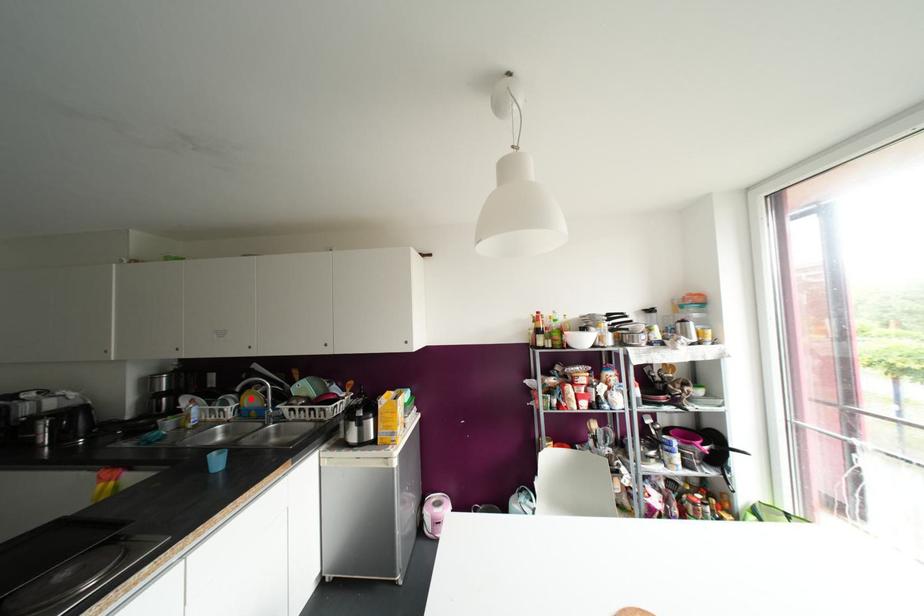
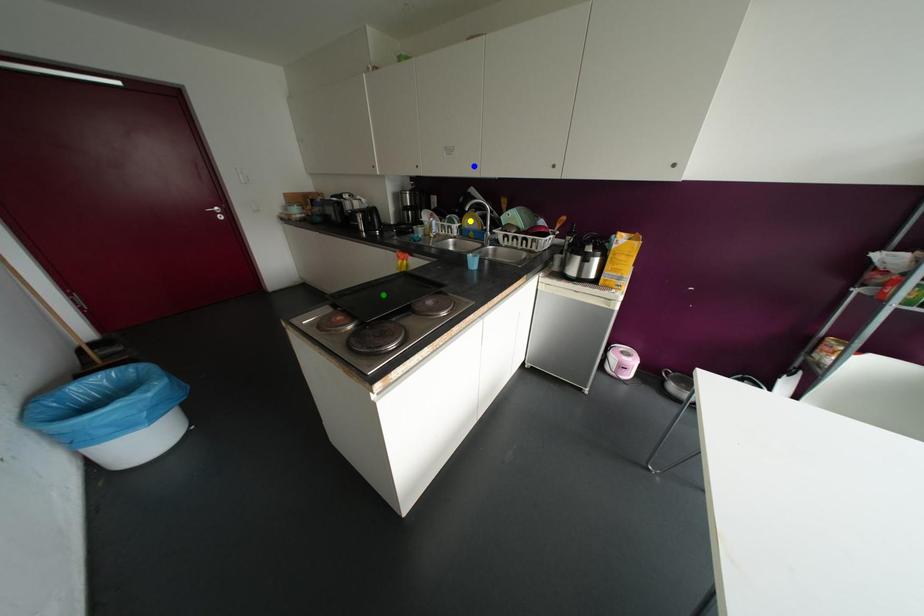
Question: I am providing you with two images of the same scene from different viewpoints. A red point is marked on the first image. You are given multiple points on the second image. Which spot in image 2 lines up with the point in image 1?

Choices:
 (A) green point
 (B) yellow point
 (C) blue point

Answer: (B)